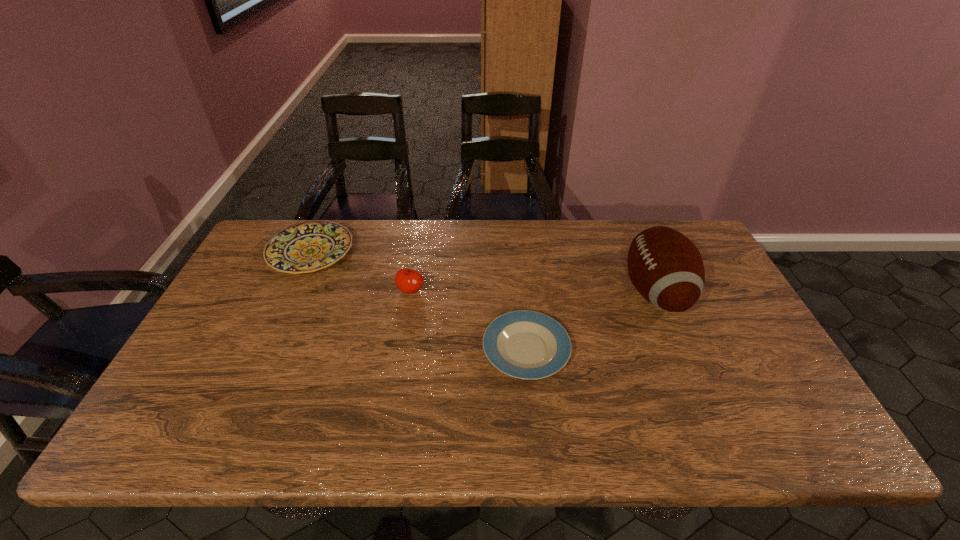
Find the location of a particular element. The image size is (960, 540). the rightmost object is located at coordinates (666, 268).

The width and height of the screenshot is (960, 540). I want to click on football, so click(666, 268).

Find the location of `apple`. apple is located at coordinates (409, 281).

Image resolution: width=960 pixels, height=540 pixels. What are the coordinates of `the third object from right to left` in the screenshot? It's located at pos(409,281).

The height and width of the screenshot is (540, 960). Identify the location of the left plate. (306, 247).

You are a GUI agent. You are given a task and a screenshot of the screen. Output one action in this format:
    pyautogui.click(x=<x>, y=<y>)
    Task: Click on the leftmost object
    The image size is (960, 540).
    Given the screenshot: What is the action you would take?
    pyautogui.click(x=306, y=247)

At what (x,y) coordinates should I click in order to perform the action: click on the nearer plate. Please return your answer as a coordinate pair (x, y). The image size is (960, 540). Looking at the image, I should click on (524, 344).

Locate an element on the screen. Image resolution: width=960 pixels, height=540 pixels. the right plate is located at coordinates (524, 344).

Locate an element on the screen. The width and height of the screenshot is (960, 540). free region located 0.280m on the laces of the rightmost object is located at coordinates (527, 292).

Identify the location of free space located on the laces of the rightmost object. Image resolution: width=960 pixels, height=540 pixels. [595, 292].